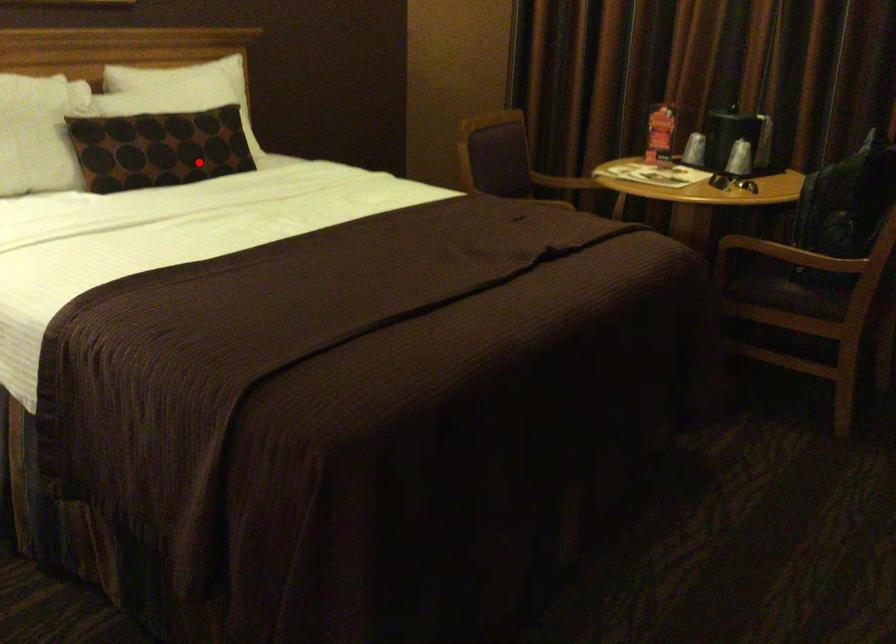
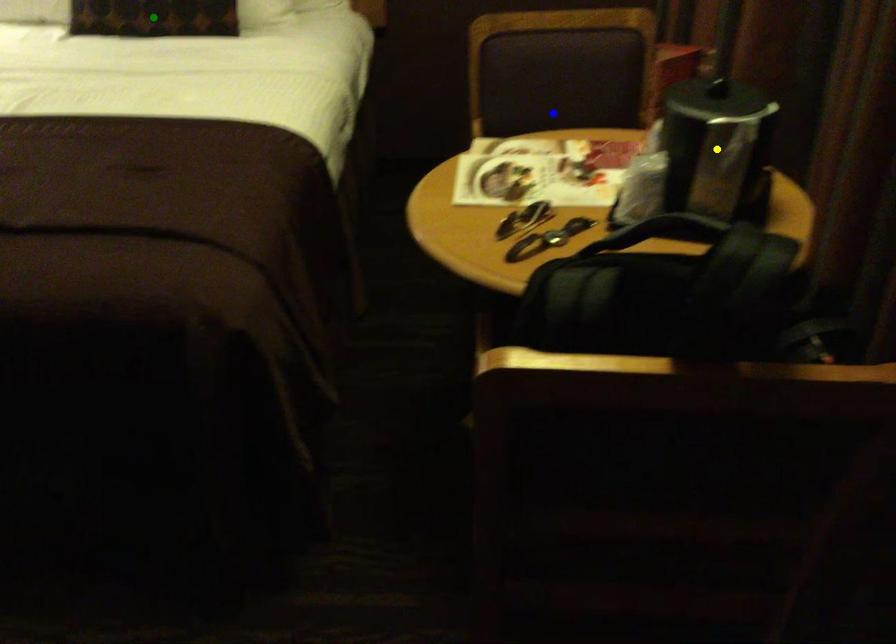
Question: I am providing you with two images of the same scene from different viewpoints. A red point is marked on the first image. You are given multiple points on the second image. Which spot in image 2 lines up with the point in image 1?

Choices:
 (A) green point
 (B) blue point
 (C) yellow point

Answer: (A)